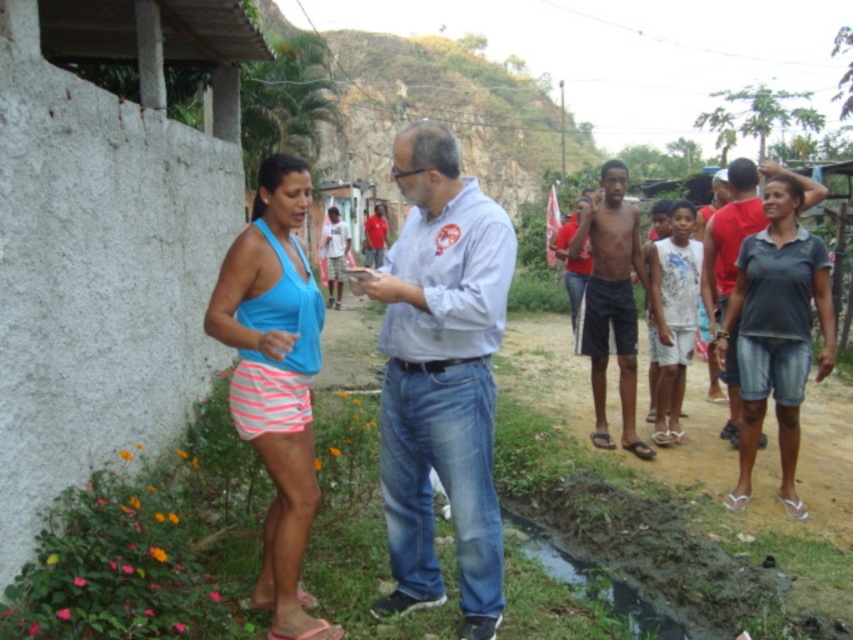
Question: Can you confirm if matte blue tank top at center is bigger than pink fabric sandal at lower left?

Choices:
 (A) yes
 (B) no

Answer: (A)

Question: Observing the image, what is the correct spatial positioning of light blue shirt at center in reference to dark gray denim shorts at right?

Choices:
 (A) left
 (B) right

Answer: (A)

Question: Which of the following is the closest to the observer?

Choices:
 (A) pink fabric sandal at lower left
 (B) dark skin/smooth skin man at center
 (C) dark gray denim shorts at right

Answer: (A)

Question: Can you confirm if light blue shirt at center is positioned to the left of matte blue tank top at center?

Choices:
 (A) no
 (B) yes

Answer: (A)

Question: Which of these objects is positioned farthest from the matte blue tank top at center?

Choices:
 (A) dark gray denim shorts at right
 (B) dark gray t-shirt at right
 (C) pink fabric sandal at lower left
 (D) dark skin/smooth skin man at center

Answer: (D)

Question: Among these points, which one is nearest to the camera?

Choices:
 (A) (315, 632)
 (B) (595, 282)
 (C) (788, 268)
 (D) (419, 556)

Answer: (A)